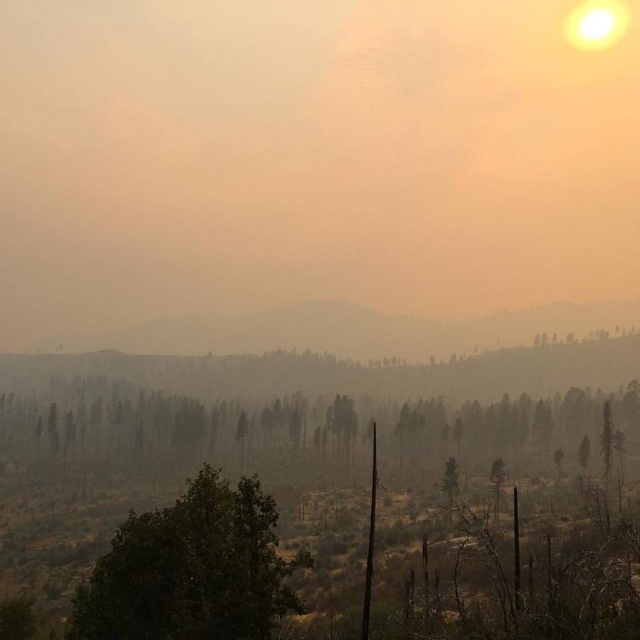
Does green matte trees at center appear over green leafy tree at center?

Correct, green matte trees at center is located above green leafy tree at center.

Who is more distant from viewer, (509, 438) or (163, 582)?

Positioned behind is point (509, 438).

Measure the distance between point (x=109, y=400) and camera.

A distance of 220.81 meters exists between point (x=109, y=400) and camera.

Locate an element on the screen. green matte trees at center is located at coordinates (314, 429).